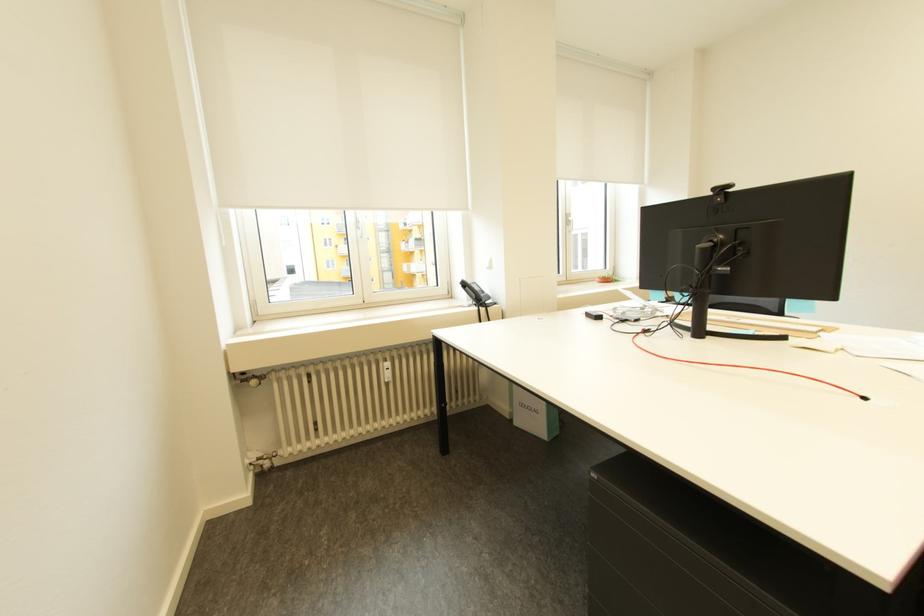
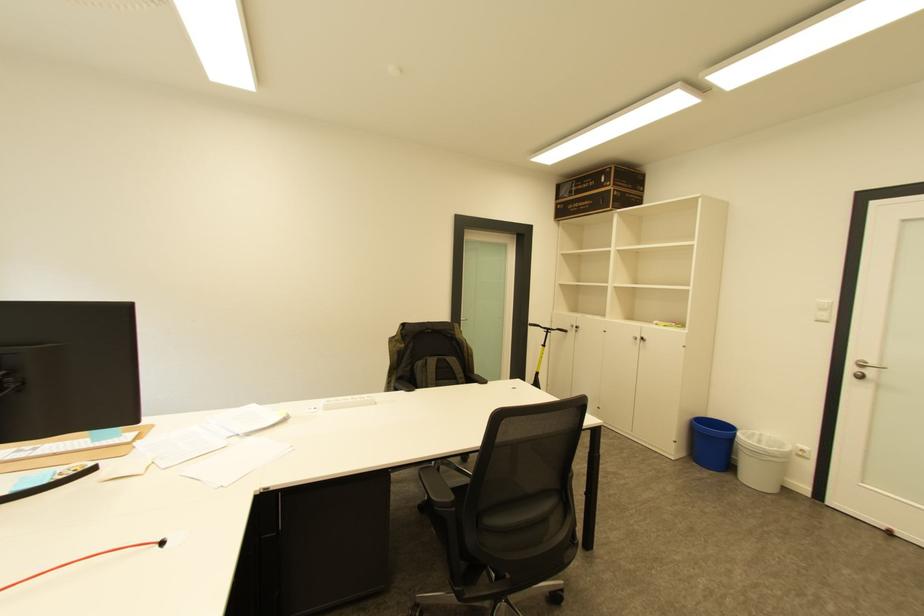
Question: The first image is from the beginning of the video and the second image is from the end. How did the camera likely rotate when shooting the video?

Choices:
 (A) Left
 (B) Right
 (C) Up
 (D) Down

Answer: (B)